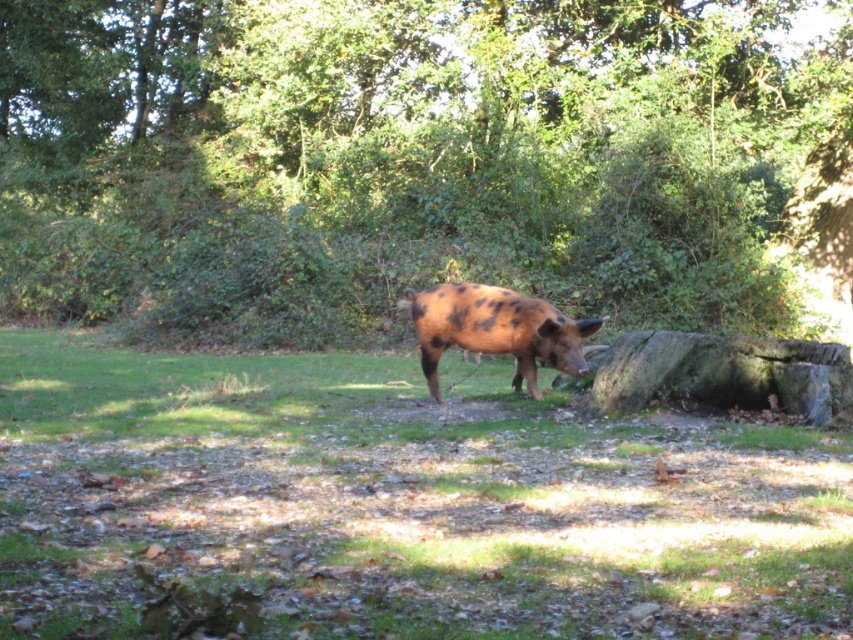
Question: Is green leafy tree at center positioned before brown grassy at center?

Choices:
 (A) no
 (B) yes

Answer: (A)

Question: Can you confirm if green leafy tree at center is positioned above brown grassy at center?

Choices:
 (A) no
 (B) yes

Answer: (B)

Question: Can you confirm if green leafy tree at center is positioned above spotted brown pig at center?

Choices:
 (A) yes
 (B) no

Answer: (A)

Question: Considering the real-world distances, which object is farthest from the brown grassy at center?

Choices:
 (A) green leafy tree at center
 (B) spotted brown pig at center

Answer: (A)

Question: Which point is farther to the camera?

Choices:
 (A) spotted brown pig at center
 (B) brown grassy at center

Answer: (A)

Question: Which of the following is the closest to the observer?

Choices:
 (A) (517, 352)
 (B) (6, 230)
 (C) (315, 540)

Answer: (C)